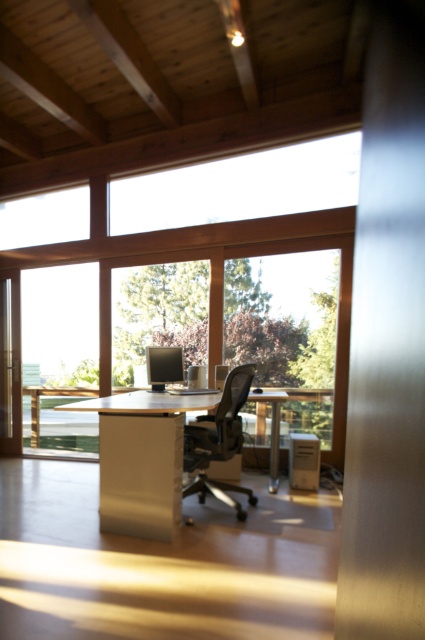
You are an office worker who wants to place a large poster on the wall behind your desk. The poster is as wide as the white glossy computer desk at center. Will the clear glass window at center block the poster from being fully visible?

The clear glass window at center occupies less space than the white glossy computer desk at center, so the poster will not be fully blocked. The portion of the poster beyond the window will remain visible.

You are an office worker who needs to move a 1.2 meter wide package across the room. The package must be placed between the white glossy computer desk at center and the matte black office chair at center. Can the space between them accommodate the package?

The white glossy computer desk at center is wider than the matte black office chair at center, so the space between them may be sufficient to fit the 1.2 meter wide package. However, without exact measurements, it is recommended to check the available space before moving the package.

You are standing in the modern office space and want to move from point A at point (189,396) to point B at point (192,452). Which point is closer to you when you start at point A?

Point A at point (189,396) is closer to you since it is further to the camera than point B at point (192,452). Wait, this seems contradictory. Let me rephrase. Since point A is further to the camera, when you are at point A, point B is behind it, so point A is your starting position and point B is further away. Therefore, point B is farther away from your starting position at point A. Wait, the question is which is closer when starting at A. The answer should clarify that point A is where you are, so